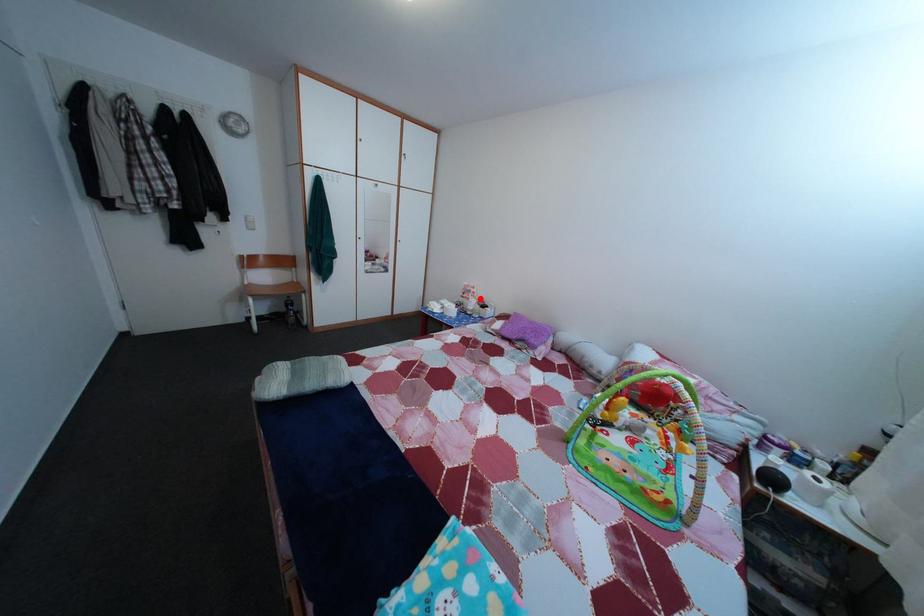
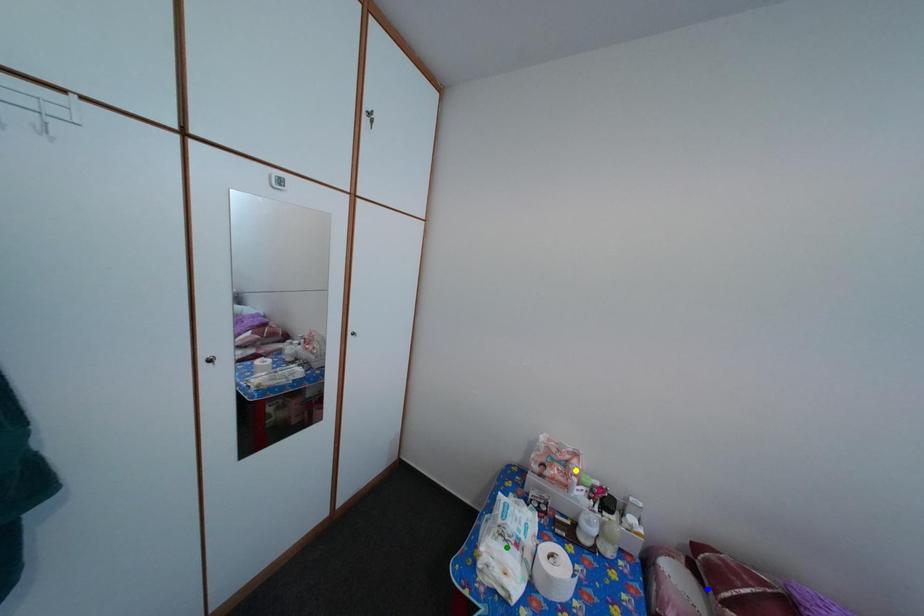
Question: I am providing you with two images of the same scene from different viewpoints. A red point is marked on the first image. You are given multiple points on the second image. In image 2, which mark is for the same physical point as the one in image 1?

Choices:
 (A) green point
 (B) yellow point
 (C) blue point

Answer: (B)